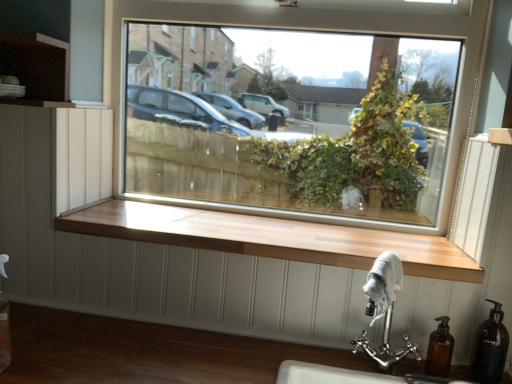
Question: Is wooden at center positioned with its back to polished chrome sink at lower right?

Choices:
 (A) yes
 (B) no

Answer: (B)

Question: Would you say wooden at center contains polished chrome sink at lower right?

Choices:
 (A) no
 (B) yes

Answer: (A)

Question: From the image's perspective, is wooden at center beneath polished chrome sink at lower right?

Choices:
 (A) yes
 (B) no

Answer: (B)

Question: Is wooden at center thinner than polished chrome sink at lower right?

Choices:
 (A) no
 (B) yes

Answer: (A)

Question: Considering the relative positions of wooden at center and polished chrome sink at lower right in the image provided, is wooden at center in front of polished chrome sink at lower right?

Choices:
 (A) no
 (B) yes

Answer: (A)

Question: Considering the relative sizes of wooden at center and polished chrome sink at lower right in the image provided, is wooden at center smaller than polished chrome sink at lower right?

Choices:
 (A) no
 (B) yes

Answer: (A)

Question: From the image's perspective, is wooden at center over brown matte soap dispenser at lower right, the 2th soap dispenser when ordered from right to left?

Choices:
 (A) yes
 (B) no

Answer: (A)

Question: Does wooden at center have a greater height compared to brown matte soap dispenser at lower right, the 2th soap dispenser when ordered from right to left?

Choices:
 (A) no
 (B) yes

Answer: (A)

Question: Can you confirm if wooden at center is wider than brown matte soap dispenser at lower right, the 2th soap dispenser when ordered from right to left?

Choices:
 (A) no
 (B) yes

Answer: (B)

Question: Is wooden at center next to brown matte soap dispenser at lower right, the 1th soap dispenser positioned from the left?

Choices:
 (A) yes
 (B) no

Answer: (B)

Question: Is wooden at center outside brown matte soap dispenser at lower right, the 2th soap dispenser when ordered from right to left?

Choices:
 (A) yes
 (B) no

Answer: (A)

Question: Is brown matte soap dispenser at lower right, the 1th soap dispenser positioned from the left, at the back of wooden at center?

Choices:
 (A) yes
 (B) no

Answer: (B)

Question: From the image's perspective, is polished chrome sink at lower right above wooden at center?

Choices:
 (A) no
 (B) yes

Answer: (A)